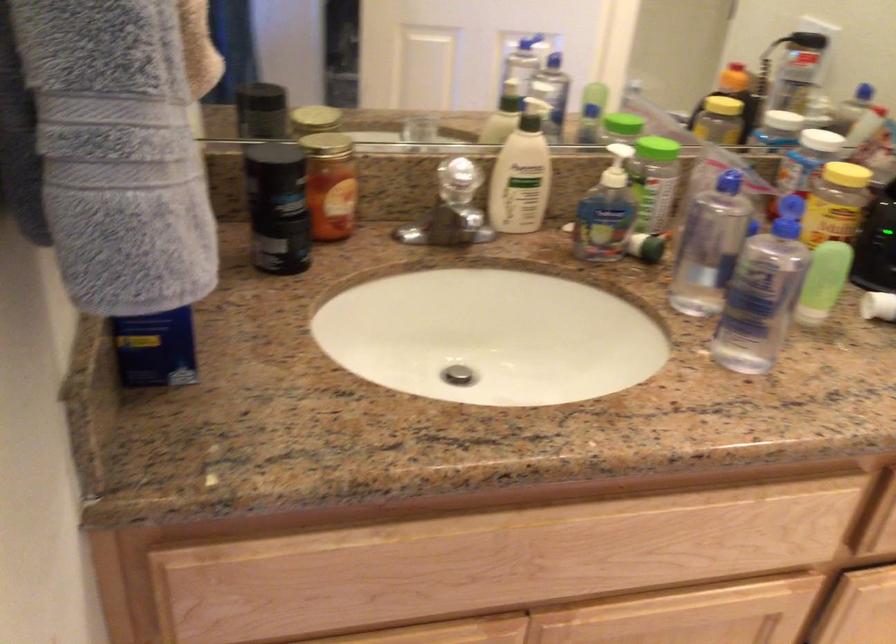
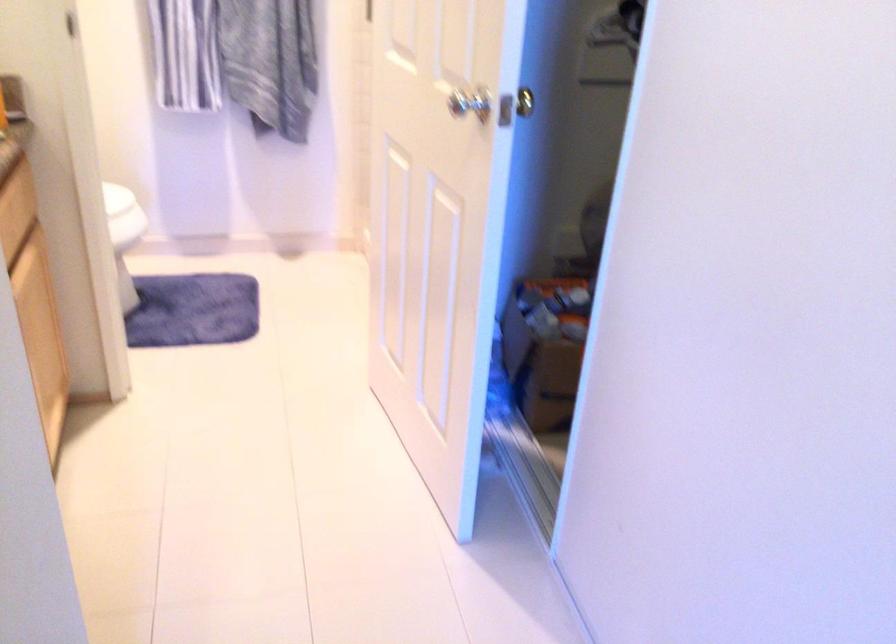
Based on the continuous images, in which direction is the camera rotating?

The rotation direction of the camera is right-down.